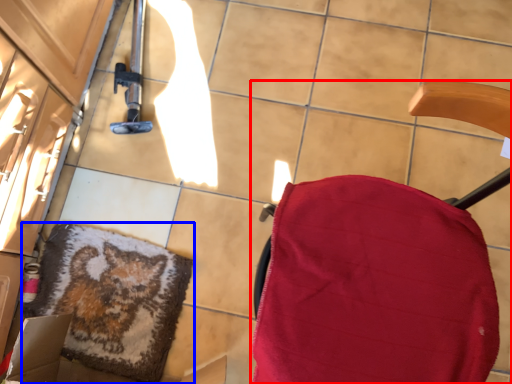
Question: Which object appears farthest to the camera in this image, furniture (highlighted by a red box) or mat (highlighted by a blue box)?

Choices:
 (A) furniture
 (B) mat

Answer: (B)